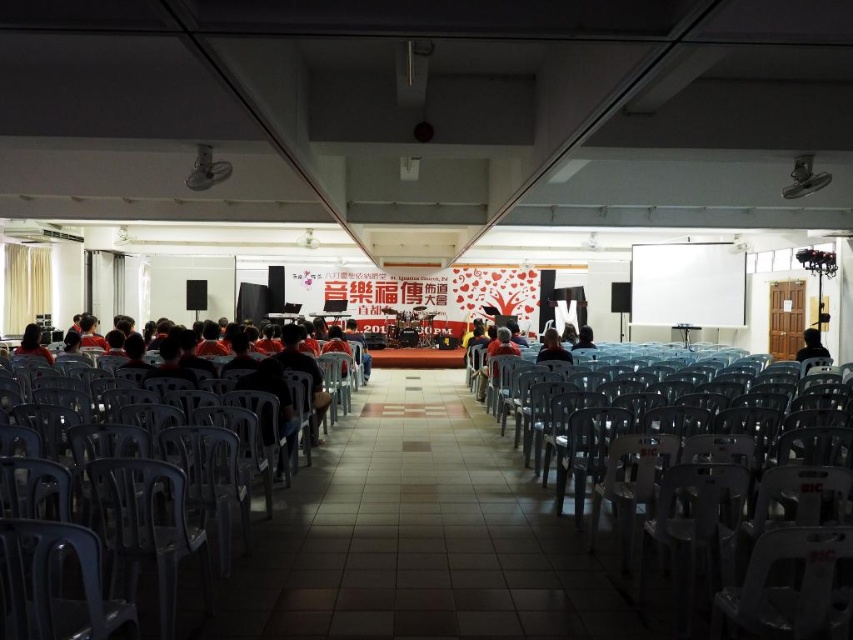
You are organizing a presentation and need to ensure that the white matte projection screen at upper center is visible to all attendees seated in the gray plastic chairs. Considering the height of the matte black shirt at center, will the screen be visible over the heads of the seated audience?

The white matte projection screen at upper center is taller than the matte black shirt at center, so it should be visible over the heads of the seated audience as long as the shirt is not blocking the line of sight.

You are standing in the front row of the event hall and notice a person with matte black hair at left. If you look straight ahead, will the banners on the back wall block your view of their hair?

The banners on the back wall are positioned behind the stage area, and the matte black hair at left is located at point (x=32, y=342). Since the banners are on the back wall and the person with matte black hair is in the foreground, their hair would be in front of the banners. Therefore, the banners would not block your view of the matte black hair at left.